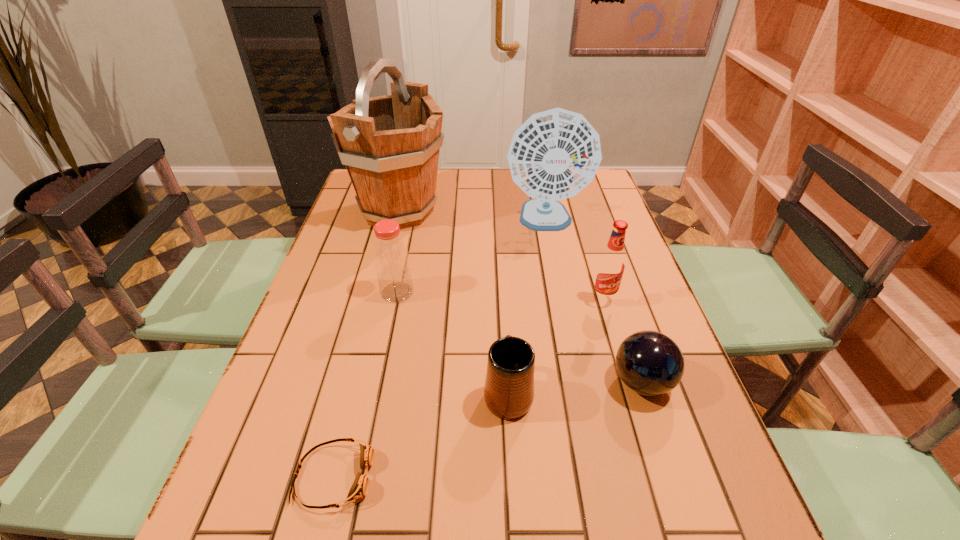
Image resolution: width=960 pixels, height=540 pixels. Identify the location of blank space at the far right corner of the desktop. (583, 190).

The image size is (960, 540). What are the coordinates of `blank region between the fan and the mug` in the screenshot? It's located at (527, 307).

Find the location of a particular element. vacant area that lies between the nearest object and the bottle is located at coordinates (366, 384).

At what (x,y) coordinates should I click in order to perform the action: click on free space between the tallest object and the mug. Please return your answer as a coordinate pair (x, y). The image size is (960, 540). Looking at the image, I should click on (453, 302).

The width and height of the screenshot is (960, 540). What are the coordinates of `free area in between the goggles and the root beer` in the screenshot? It's located at (468, 388).

The image size is (960, 540). I want to click on vacant space in between the goggles and the root beer, so click(468, 388).

Identify the location of empty space between the root beer and the mug. The image size is (960, 540). (555, 346).

Where is `unoccupied area between the bottle and the shortest object`? The height and width of the screenshot is (540, 960). unoccupied area between the bottle and the shortest object is located at coordinates (366, 384).

This screenshot has width=960, height=540. What are the coordinates of `vacant space that is in between the nearest object and the tallest object` in the screenshot? It's located at (366, 343).

The height and width of the screenshot is (540, 960). In order to click on empty location between the fan and the bucket in this screenshot , I will do `click(471, 216)`.